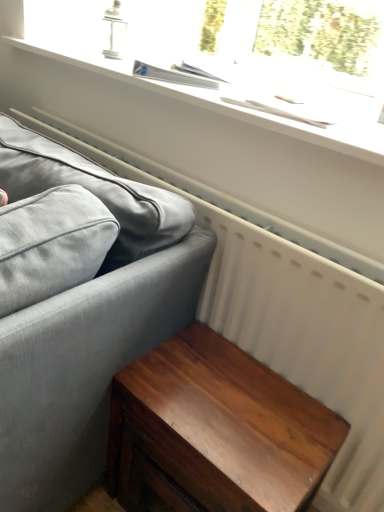
In order to click on vacant point above shiny brown wood table at lower right (from a real-world perspective) in this screenshot , I will do `click(242, 396)`.